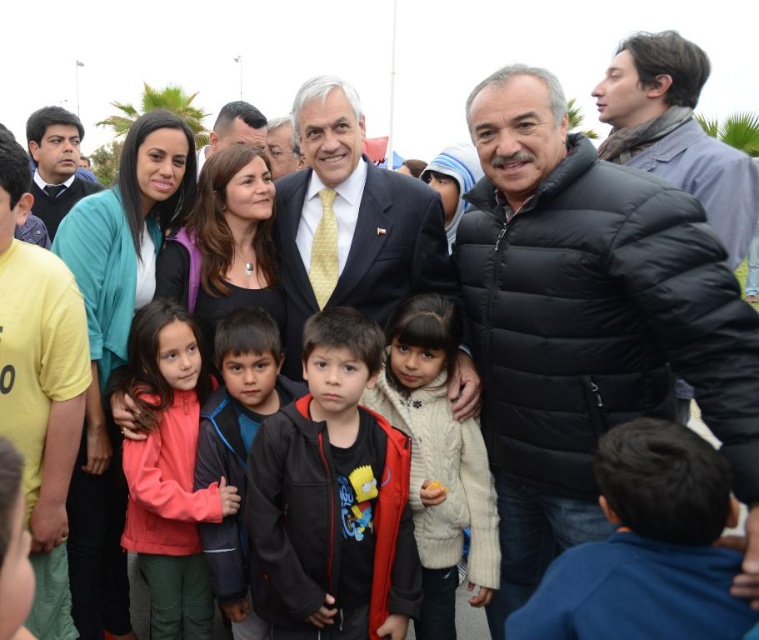
In the scene shown: You are standing in the waterfront area where the group is gathered. You need to walk to both the point at coordinates point (435, 458) and point (739, 230). Which point will you reach first if you start walking towards them?

You will reach point (435, 458) first because it is closer to you than point (739, 230).

You are a photographer at the event and need to capture a photo where both the matte pink jacket at center and the matte black suit at left are visible. Given their positions, which one should you ensure is closer to the camera to include both in the frame?

The matte pink jacket at center is below the matte black suit at left. To include both in the frame, ensure the matte black suit at left is closer to the camera so that the matte pink jacket at center, being lower, can still be captured within the photo.

You are organizing a photo shoot and need to arrange two models wearing the black matte jacket at center and the matte black suit at left. Based on the scene, which model should stand to the right to maintain the original composition?

The black matte jacket at center should stand to the right of the matte black suit at left to maintain the original composition as described.